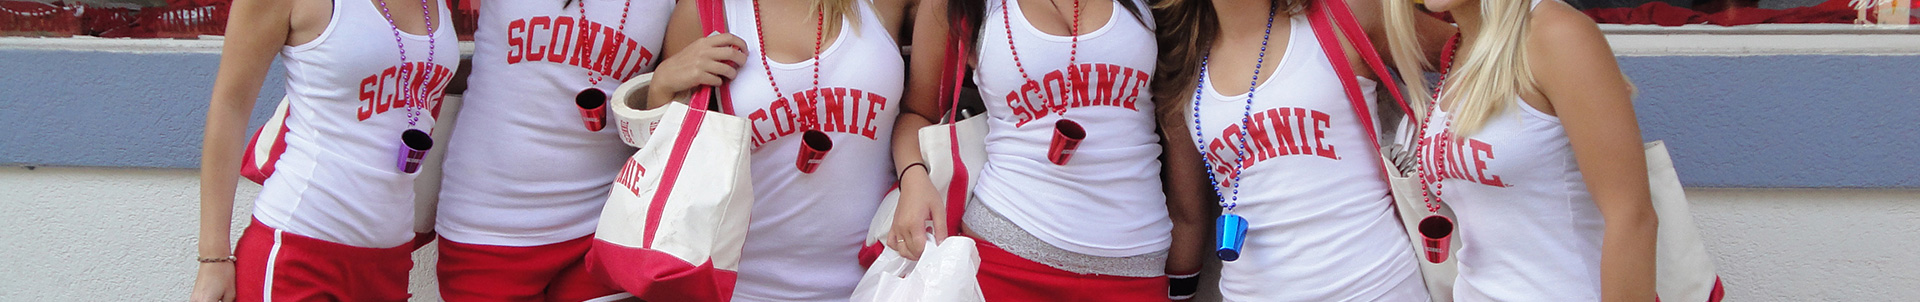
Locate an element on the screen. purple shot glass is located at coordinates (422, 162).